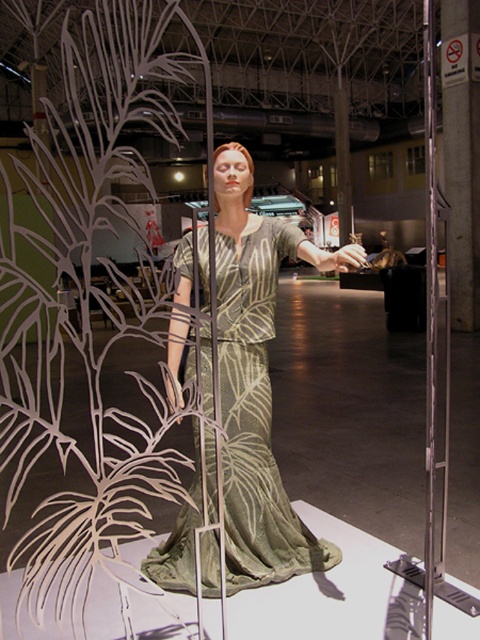
Question: Is green leafy plant at center below silvery metallic dress at center?

Choices:
 (A) yes
 (B) no

Answer: (B)

Question: Is green leafy plant at center closer to camera compared to silvery metallic dress at center?

Choices:
 (A) yes
 (B) no

Answer: (A)

Question: Among these points, which one is nearest to the camera?

Choices:
 (A) (15, 225)
 (B) (252, 449)

Answer: (B)

Question: Is the position of green leafy plant at center more distant than that of silvery metallic dress at center?

Choices:
 (A) yes
 (B) no

Answer: (B)